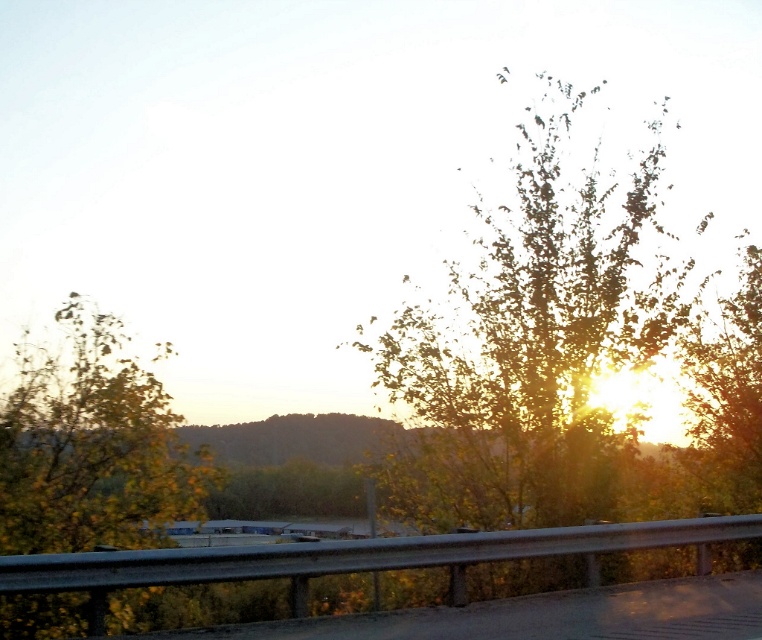
From the picture: Between green leafy tree at center and green leafy tree at left, which one appears on the left side from the viewer's perspective?

From the viewer's perspective, green leafy tree at left appears more on the left side.

Who is more forward, (402, 307) or (213, 474)?

Point (213, 474) is more forward.

Describe the element at coordinates (530, 344) in the screenshot. I see `green leafy tree at center` at that location.

Find the location of `green leafy tree at center`. green leafy tree at center is located at coordinates (530, 344).